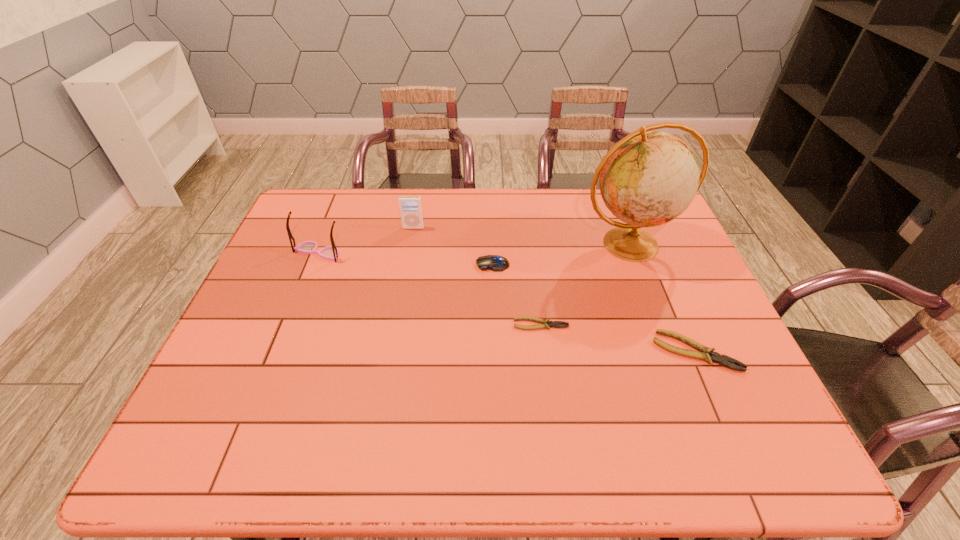
In order to click on vacant space located 0.370m on the left of the globe in this screenshot , I will do `click(457, 245)`.

At what (x,y) coordinates should I click in order to perform the action: click on free region located 0.120m on the right of the spectacles. Please return your answer as a coordinate pair (x, y). The height and width of the screenshot is (540, 960). Looking at the image, I should click on (384, 253).

Locate an element on the screen. The height and width of the screenshot is (540, 960). vacant point located on the front-facing side of the fifth object from right to left is located at coordinates (401, 295).

Identify the location of free location located 0.180m on the button side of the third shortest object. (415, 264).

Locate an element on the screen. vacant space located on the button side of the third shortest object is located at coordinates (367, 264).

Where is `vacant space located 0.270m on the button side of the third shortest object`? This screenshot has width=960, height=540. vacant space located 0.270m on the button side of the third shortest object is located at coordinates (384, 264).

Identify the location of globe that is at the far edge. The height and width of the screenshot is (540, 960). (648, 178).

I want to click on iPod that is positioned at the far edge, so click(411, 212).

Where is `object that is at the left edge`? Image resolution: width=960 pixels, height=540 pixels. object that is at the left edge is located at coordinates (331, 253).

Image resolution: width=960 pixels, height=540 pixels. In order to click on pliers situated at the right edge in this screenshot , I will do `click(705, 352)`.